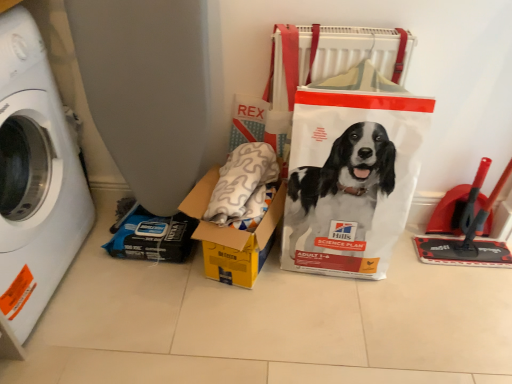
In order to click on free space that is in between white plastic bag at center and yellow cardboard box at center in this screenshot , I will do `click(308, 297)`.